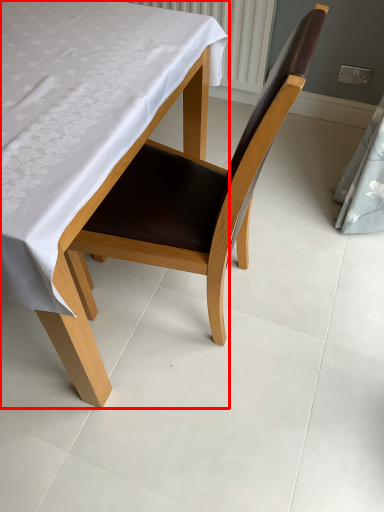
Question: Where is table (annotated by the red box) located in relation to chair in the image?

Choices:
 (A) left
 (B) right

Answer: (A)